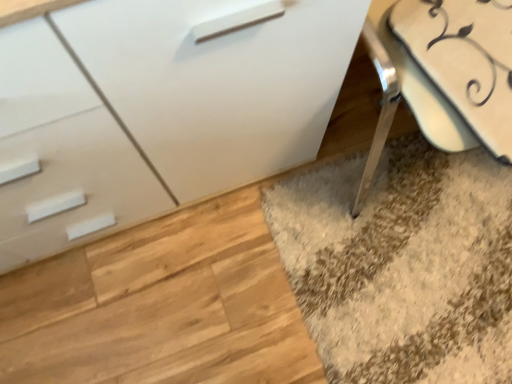
Question: Is white glossy swivel chair at lower right inside or outside of white glossy chest of drawers at center?

Choices:
 (A) inside
 (B) outside

Answer: (B)

Question: In the image, is white glossy swivel chair at lower right positioned in front of or behind white glossy chest of drawers at center?

Choices:
 (A) front
 (B) behind

Answer: (B)

Question: Looking at their shapes, would you say white glossy swivel chair at lower right is wider or thinner than white glossy chest of drawers at center?

Choices:
 (A) wide
 (B) thin

Answer: (A)

Question: In terms of height, does white glossy chest of drawers at center look taller or shorter compared to white glossy swivel chair at lower right?

Choices:
 (A) tall
 (B) short

Answer: (A)

Question: Is point (221, 148) positioned closer to the camera than point (497, 92)?

Choices:
 (A) farther
 (B) closer

Answer: (A)

Question: Relative to white glossy swivel chair at lower right, is white glossy chest of drawers at center in front or behind?

Choices:
 (A) front
 (B) behind

Answer: (A)

Question: In terms of width, does white glossy chest of drawers at center look wider or thinner when compared to white glossy swivel chair at lower right?

Choices:
 (A) thin
 (B) wide

Answer: (A)